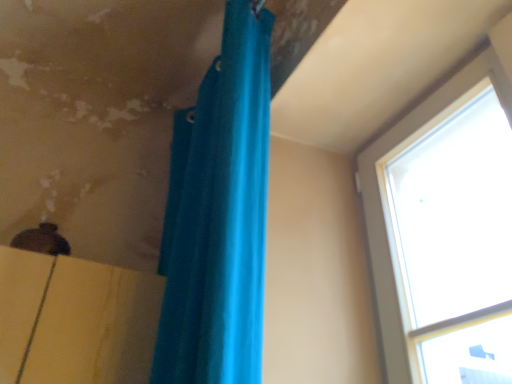
The image size is (512, 384). What are the coordinates of `teal fabric curtain at center` in the screenshot? It's located at (218, 216).

This screenshot has height=384, width=512. What do you see at coordinates (218, 216) in the screenshot? I see `teal fabric curtain at center` at bounding box center [218, 216].

The height and width of the screenshot is (384, 512). I want to click on teal fabric curtain at center, so click(x=218, y=216).